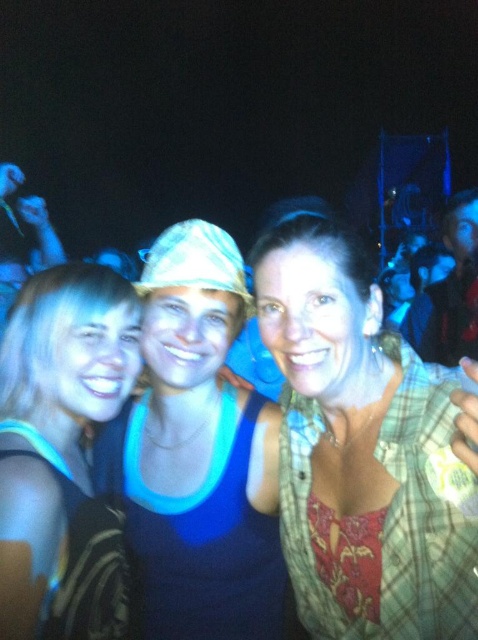
From the picture: Can you confirm if plaid fabric shirt at center is taller than blonde hair at left?

Correct, plaid fabric shirt at center is much taller as blonde hair at left.

The image size is (478, 640). Describe the element at coordinates (365, 449) in the screenshot. I see `plaid fabric shirt at center` at that location.

The image size is (478, 640). In order to click on plaid fabric shirt at center in this screenshot , I will do `click(365, 449)`.

Which of these two, blue fabric tank top at center or blonde hair at left, stands shorter?

Standing shorter between the two is blonde hair at left.

Identify the location of blue fabric tank top at center. (195, 456).

Find the location of a particular element. The width and height of the screenshot is (478, 640). blue fabric tank top at center is located at coordinates (195, 456).

Who is more forward, (359, 362) or (217, 547)?

Point (359, 362) is more forward.

Is plaid fabric shirt at center bigger than blue fabric tank top at center?

Incorrect, plaid fabric shirt at center is not larger than blue fabric tank top at center.

Who is more forward, (401,388) or (232,250)?

Point (401,388) is in front.

I want to click on plaid fabric shirt at center, so click(x=365, y=449).